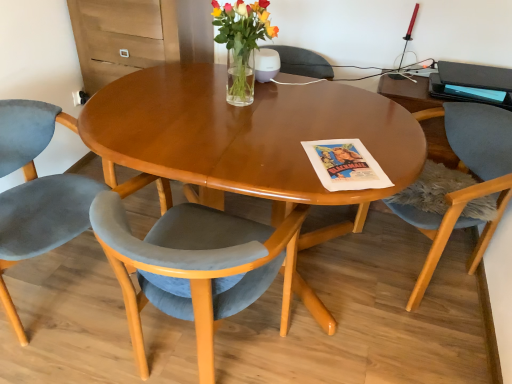
Locate an element on the screen. The height and width of the screenshot is (384, 512). free spot above velvet grey chair at lower left, acting as the 2th chair starting from the left (from a real-world perspective) is located at coordinates (215, 166).